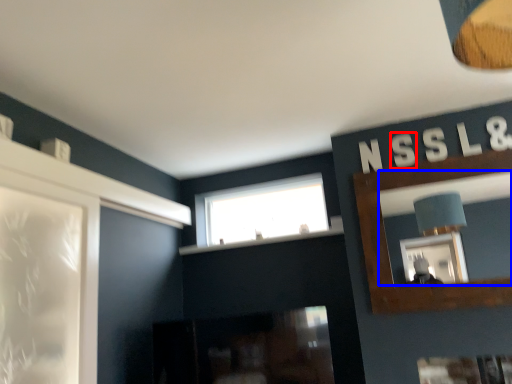
Question: Which point is further to the camera, letter (highlighted by a red box) or mirror (highlighted by a blue box)?

Choices:
 (A) letter
 (B) mirror

Answer: (A)